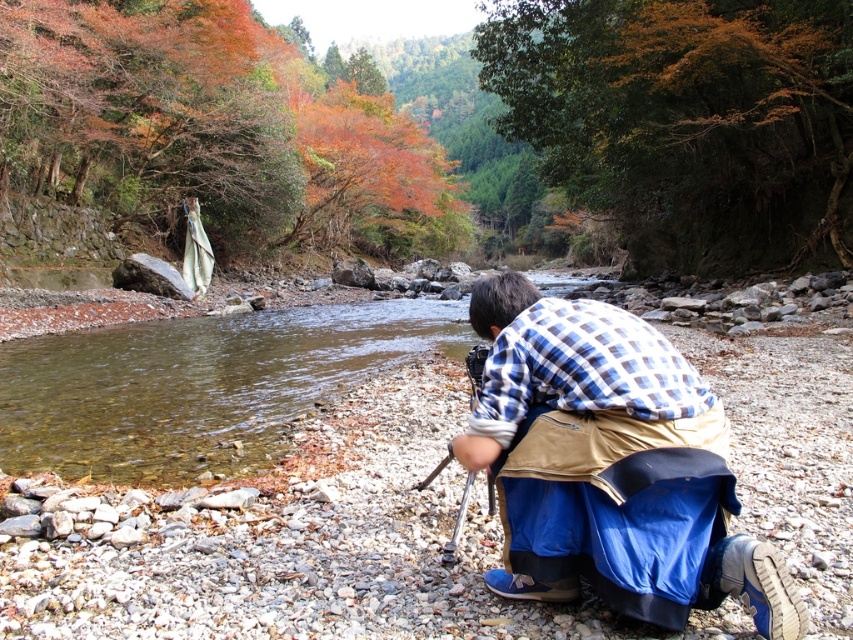
You are standing at the point with coordinates (607, 464) in the image. What object is located exactly at this point?

The blue plaid shirt at center is located exactly at point (607, 464).

You are a photographer trying to set up your tripod in the scene. You have two options for placement near the blue plaid shirt at center and the clear water at stream center. Which location allows the tripod to be fully visible without being obstructed by the other object?

The blue plaid shirt at center is shorter than the clear water at stream center, so placing the tripod near the blue plaid shirt at center would allow it to be fully visible since the shirt is shorter and less likely to obstruct the view compared to the taller clear water at stream center.

You are standing at the point with coordinates point [524,460] and want to walk to point [206,461]. Which direction should you move in to get closer to your destination?

You should move downward because point [206,461] is further away from the viewer compared to point [524,460], so moving downward will take you towards it.